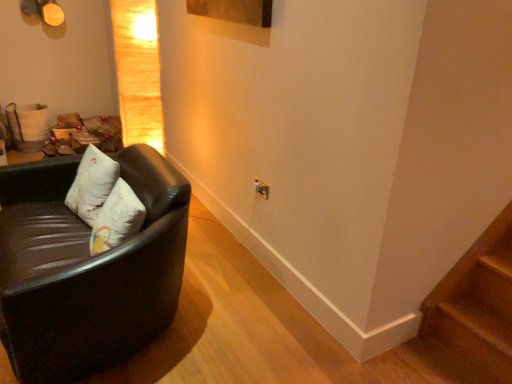
Question: Is matte gold lampshade at upper left spatially inside white soft pillow at left, or outside of it?

Choices:
 (A) inside
 (B) outside

Answer: (B)

Question: From a real-world perspective, is matte gold lampshade at upper left physically located above or below white soft pillow at left?

Choices:
 (A) below
 (B) above

Answer: (B)

Question: Which is farther from the wooden at lower right?

Choices:
 (A) white soft pillow at left
 (B) black leather couch at left
 (C) matte gold lampshade at upper left

Answer: (C)

Question: Estimate the real-world distances between objects in this image. Which object is farther from the white soft pillow at left?

Choices:
 (A) black leather couch at left
 (B) wooden at lower right
 (C) matte gold lampshade at upper left

Answer: (B)